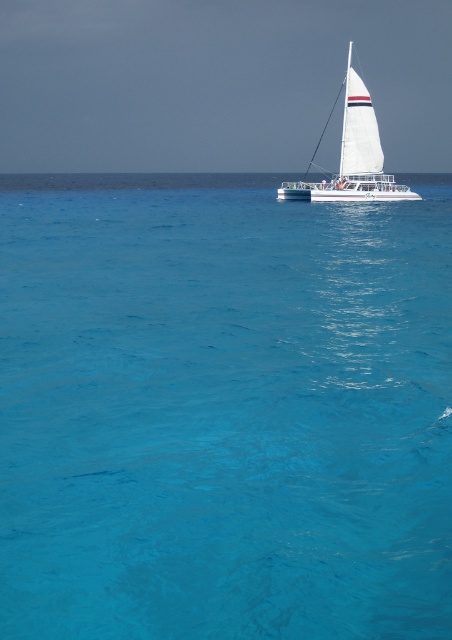
You are standing on a beach and see the sailboat at point (183,280) in the distance. If the camera is 81.29 feet away from the sailboat, can you estimate how far the sailboat is from the beach where you are standing?

The sailboat at point (183,280) is 81.29 feet away from the camera, so the distance from the beach would be approximately the same as the camera is likely positioned at your eye level on the beach.

You are standing on the deck of the white sailboat at center and want to observe the transparent blue water at center. In which direction should you look relative to the boat?

You should look to the left side of the white sailboat at center to see the transparent blue water at center, as the water is positioned on the left side of the boat.